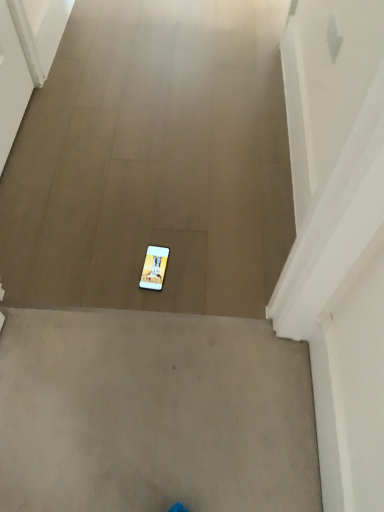
Where is `spots to the right of white glossy mobile phone at center`? Image resolution: width=384 pixels, height=512 pixels. spots to the right of white glossy mobile phone at center is located at coordinates (201, 272).